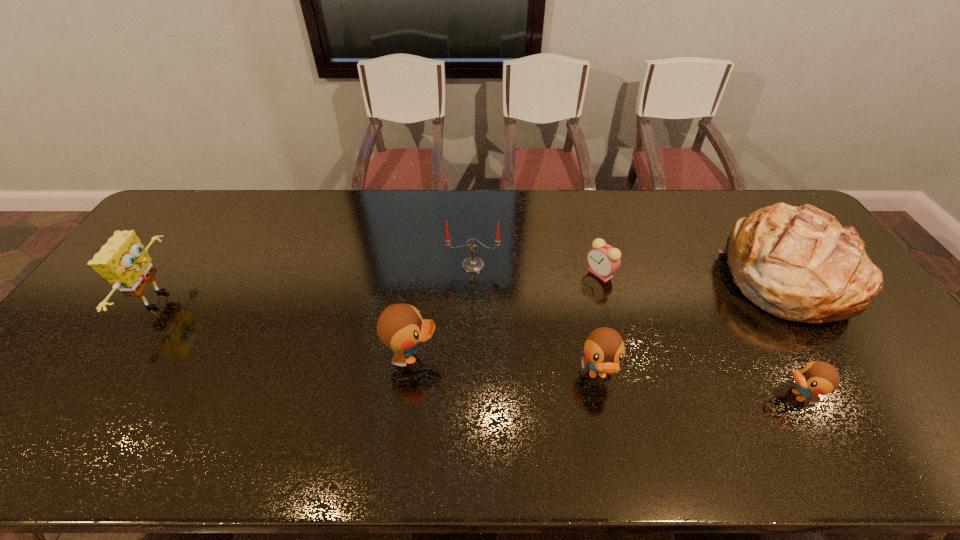
Locate an element on the screen. vacant place for an extra duck on the left is located at coordinates (238, 338).